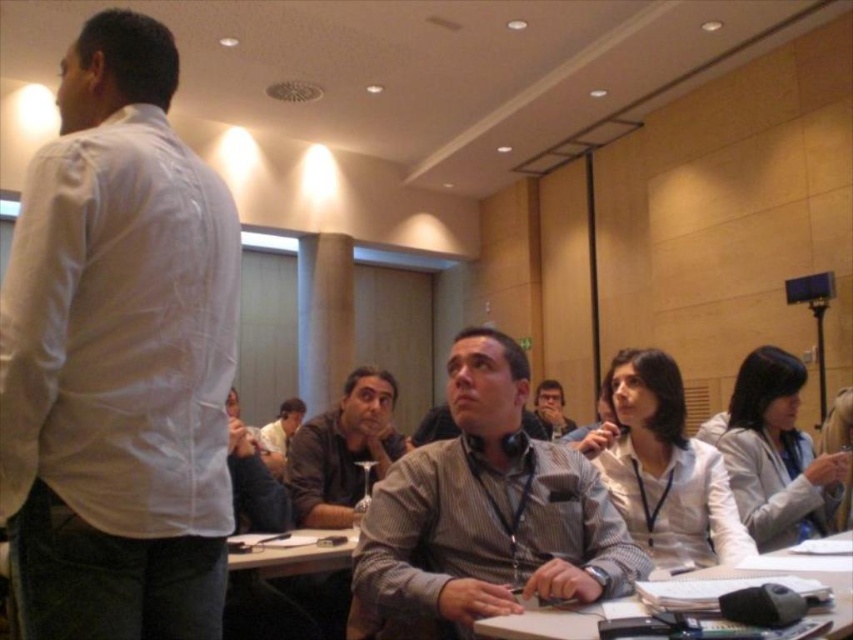
Question: Which point appears closest to the camera in this image?

Choices:
 (A) (x=252, y=605)
 (B) (x=561, y=397)
 (C) (x=138, y=387)
 (D) (x=396, y=461)

Answer: (C)

Question: Is white cotton shirt at left below white plastic table at center?

Choices:
 (A) no
 (B) yes

Answer: (A)

Question: Is brown leather jacket at center bigger than gray striped shirt at center?

Choices:
 (A) no
 (B) yes

Answer: (A)

Question: Estimate the real-world distances between objects in this image. Which object is closer to the white plastic table at center?

Choices:
 (A) white paper at center
 (B) white cotton shirt at left

Answer: (B)

Question: Can you confirm if white paper at center is wider than gray striped shirt at center?

Choices:
 (A) no
 (B) yes

Answer: (B)

Question: Which object appears farthest from the camera in this image?

Choices:
 (A) gray striped shirt at center
 (B) striped cotton shirt at center

Answer: (A)